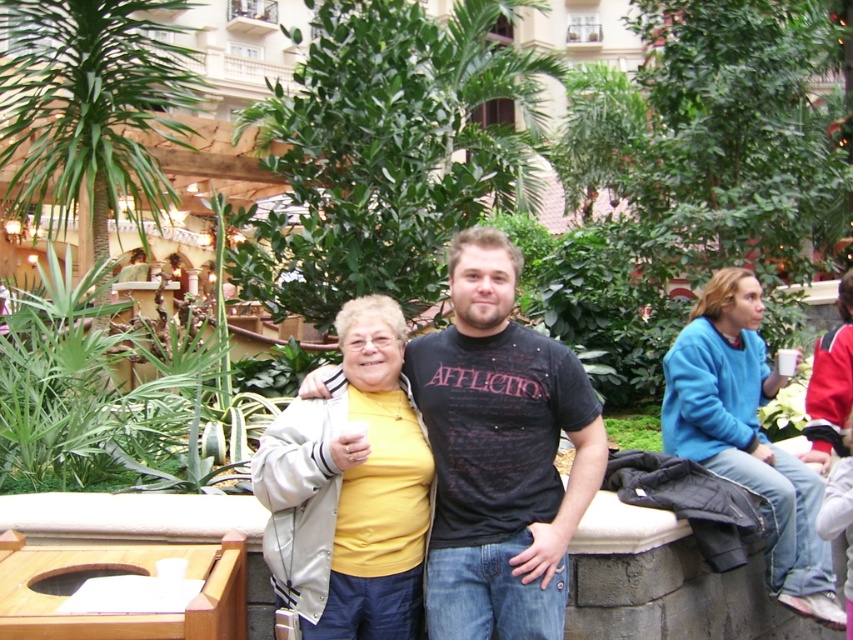
Question: Which point is farther to the camera?

Choices:
 (A) (471, 401)
 (B) (822, 586)
 (C) (114, 452)

Answer: (C)

Question: Which of the following is the closest to the observer?

Choices:
 (A) blue fleece jacket at right
 (B) green leafy plant at center
 (C) black matte t-shirt at center
 (D) white fabric jacket at center

Answer: (D)

Question: Does black matte t-shirt at center have a lesser width compared to blue fleece jacket at right?

Choices:
 (A) no
 (B) yes

Answer: (A)

Question: Which of the following is the closest to the observer?

Choices:
 (A) green leafy plant at center
 (B) blue fleece jacket at right

Answer: (B)

Question: Can you confirm if white fabric jacket at center is smaller than blue fleece jacket at right?

Choices:
 (A) no
 (B) yes

Answer: (B)

Question: From the image, what is the correct spatial relationship of white fabric jacket at center in relation to green leafy plant at center?

Choices:
 (A) above
 (B) below

Answer: (A)